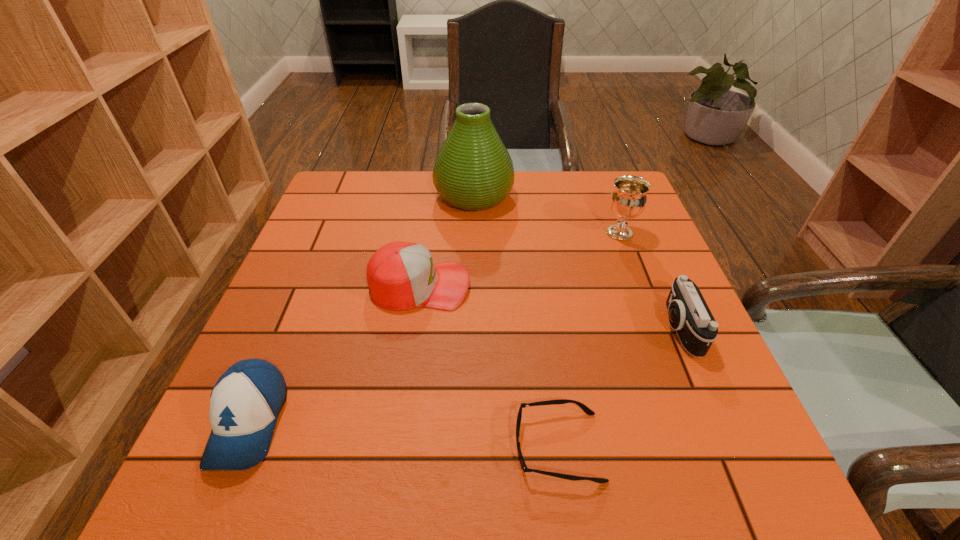
I want to click on spectacles that is positioned at the near edge, so click(587, 410).

The width and height of the screenshot is (960, 540). What are the coordinates of `object located at the left edge` in the screenshot? It's located at (245, 402).

The image size is (960, 540). I want to click on chalice at the right edge, so click(x=628, y=199).

The image size is (960, 540). Find the location of `camera at the right edge`. camera at the right edge is located at coordinates (689, 315).

Find the location of a particular element. This screenshot has height=540, width=960. object at the near left corner is located at coordinates (245, 402).

In the image, there is a desktop. Identify the location of vacant region at the far edge. (565, 171).

At what (x,y) coordinates should I click in order to perform the action: click on free point at the near edge. Please return your answer as a coordinate pair (x, y). Image resolution: width=960 pixels, height=540 pixels. Looking at the image, I should click on (610, 505).

Identify the location of vacant region at the left edge of the desktop. (305, 247).

Where is `blank space at the right edge of the desktop`? This screenshot has width=960, height=540. blank space at the right edge of the desktop is located at coordinates (650, 249).

Where is `free space at the far left corner`? This screenshot has width=960, height=540. free space at the far left corner is located at coordinates (335, 188).